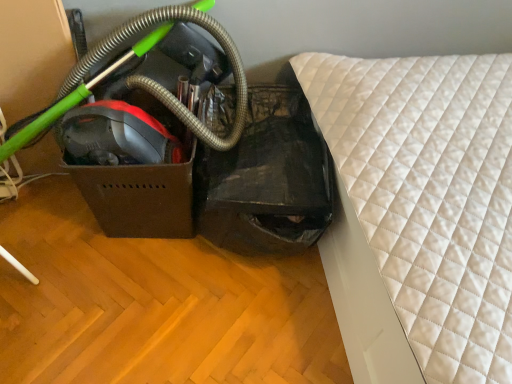
This screenshot has width=512, height=384. I want to click on free spot below green rubber garden hose at left (from a real-world perspective), so click(58, 217).